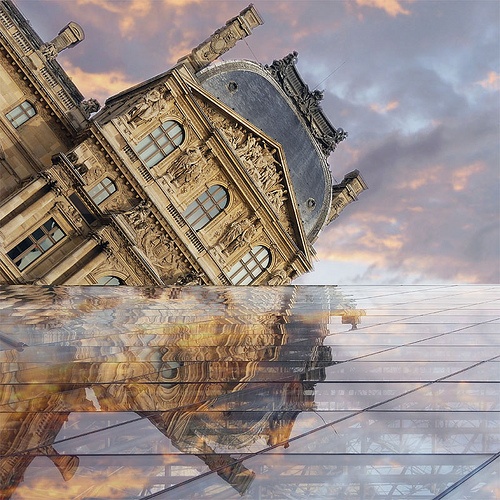
You are a GUI agent. You are given a task and a screenshot of the screen. Output one action in this format:
    pyautogui.click(x=<x>, y=<y>)
    Task: Click on the ledge
    This screenshot has height=500, width=500.
    Given the screenshot: What is the action you would take?
    pyautogui.click(x=74, y=170), pyautogui.click(x=123, y=228)